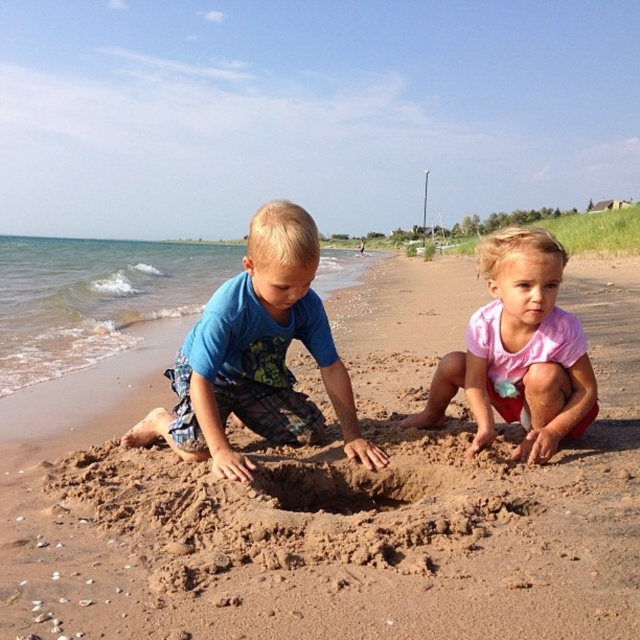
You are a parent watching your children play on the beach. You notice the blue cotton shirt at center and the pink fabric at center. How far apart are these two items from each other?

The blue cotton shirt at center and pink fabric at center are 3.34 feet apart.

You are standing on the beach and see two points marked on the sand. The first point is at coordinates point (282, 349) and the second is at point (518, 349). Which point is closer to you?

Point (282, 349) is closer to the viewer than point (518, 349).